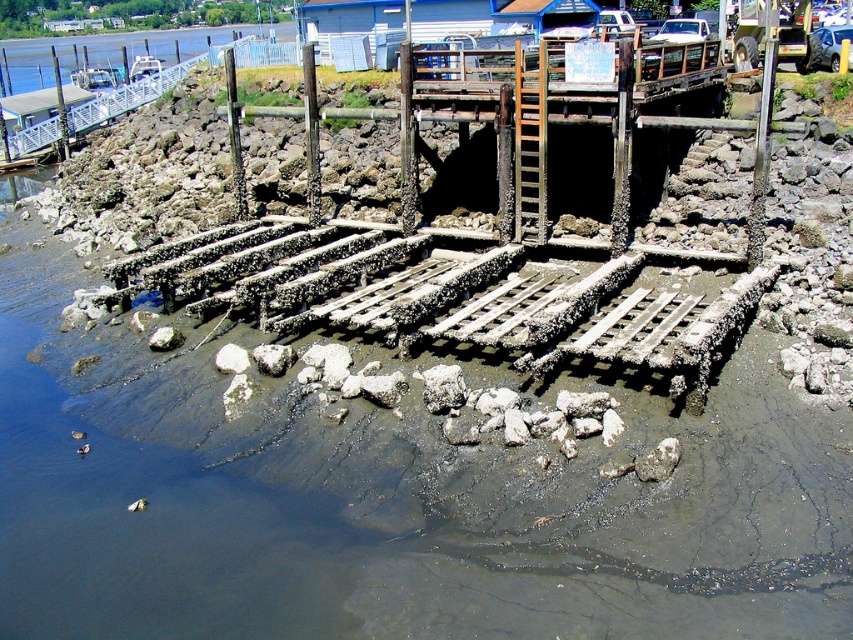
You are standing on the muddy shore and want to reach the rusty wood dock at center. Which direction should you walk to avoid the rusty metal dock at lower center?

You should walk to the right because the rusty metal dock at lower center is to the left of the rusty wood dock at center, so moving right would take you away from it.

You are standing at the edge of the dock and want to reach both points mentioned. Which point, point (474, 305) or point (505, 138), is closer to you?

Point (474, 305) is closer to the viewer than point (505, 138).

You are a maintenance worker assessing the dock structures. Which dock, the rusty metal dock at lower center or the rusty wood dock at center, requires immediate attention due to height discrepancies that could affect safety?

The rusty metal dock at lower center requires immediate attention because it is much taller than the rusty wood dock at center, creating an uneven surface that could pose safety risks.